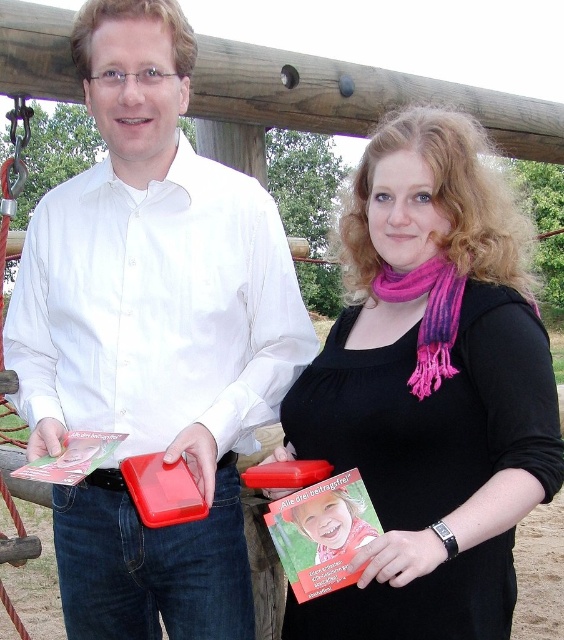
You are a librarian organizing books on a shelf. You have two books to place on the same shelf spot. The matte plastic book at center and the matte black book at center. Given their positions in the image, which book should you place on the bottom shelf?

The matte plastic book at center should be placed on the bottom shelf because in the image, it is located below the matte black book at center.

What is the position of the matte plastic book at center in the image?

The matte plastic book at center is located at point coordinates of (152, 337).